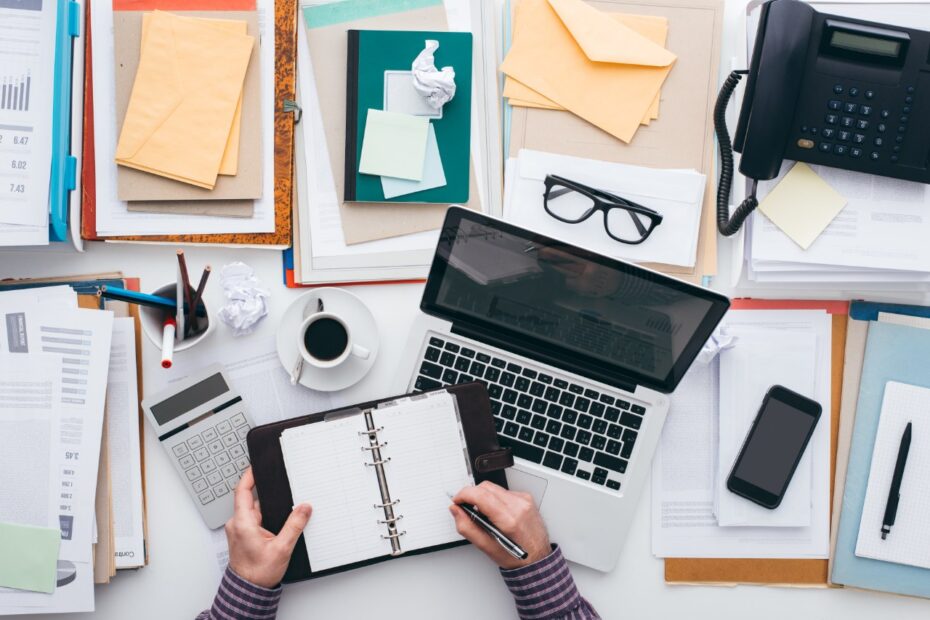
I want to click on binder rings, so click(362, 430), click(372, 441), click(377, 462), click(390, 505), click(391, 521), click(391, 539).